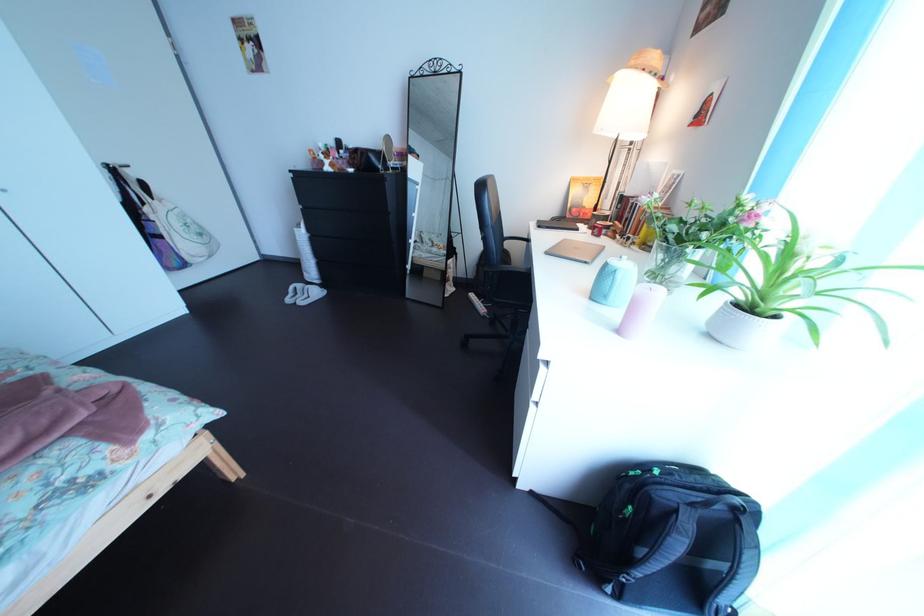
The width and height of the screenshot is (924, 616). Describe the element at coordinates (188, 235) in the screenshot. I see `a white tote bag` at that location.